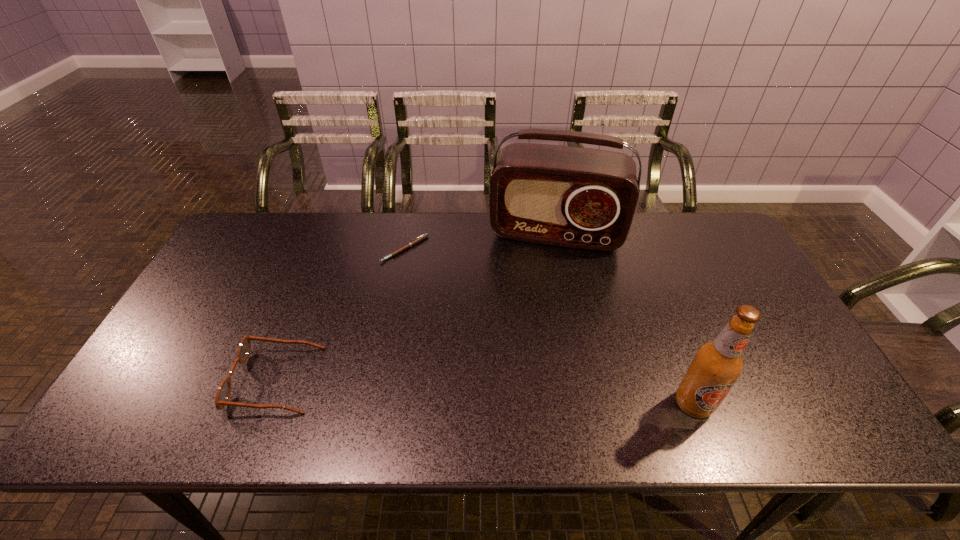
Find the location of a particular element. This screenshot has width=960, height=540. vacant space in between the leftmost object and the radio receiver is located at coordinates (416, 307).

This screenshot has width=960, height=540. In order to click on free space between the pen and the leftmost object in this screenshot , I will do `click(340, 315)`.

Locate an element on the screen. free space that is in between the third object from right to left and the third tallest object is located at coordinates (340, 315).

The image size is (960, 540). Identify the location of blank region between the beer bottle and the leftmost object. click(x=485, y=392).

Find the location of a particular element. This screenshot has width=960, height=540. free space between the beer bottle and the radio receiver is located at coordinates (625, 319).

Locate an element on the screen. object that can be found as the second closest to the radio receiver is located at coordinates (718, 364).

Locate an element on the screen. The width and height of the screenshot is (960, 540). the third closest object to the beer bottle is located at coordinates (223, 393).

In order to click on blank space that satisfies the following two spatial constraints: 1. on the back side of the pen; 2. on the right side of the radio receiver in this screenshot , I will do `click(408, 233)`.

Identify the location of free space that satisfies the following two spatial constraints: 1. on the back side of the radio receiver; 2. on the right side of the pen. This screenshot has height=540, width=960. (408, 233).